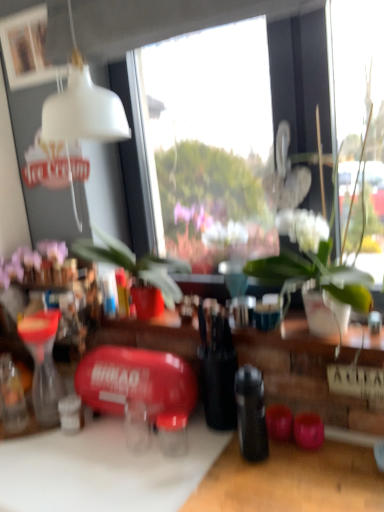
You are a GUI agent. You are given a task and a screenshot of the screen. Output one action in this format:
    pyautogui.click(x=<x>, y=<y>)
    Task: Click on the vacant space to the right of black matte bottle at center
    This screenshot has height=512, width=384.
    Given the screenshot: What is the action you would take?
    pyautogui.click(x=317, y=470)